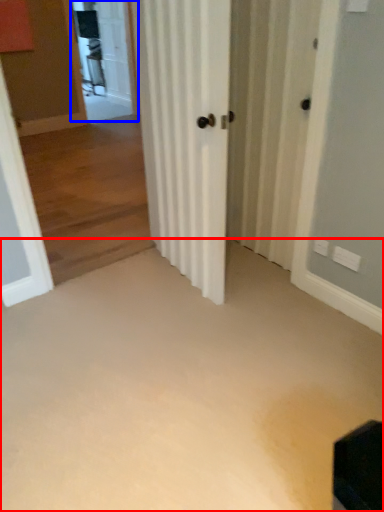
Question: Among these objects, which one is nearest to the camera, corridor (highlighted by a red box) or screen door (highlighted by a blue box)?

Choices:
 (A) corridor
 (B) screen door

Answer: (A)